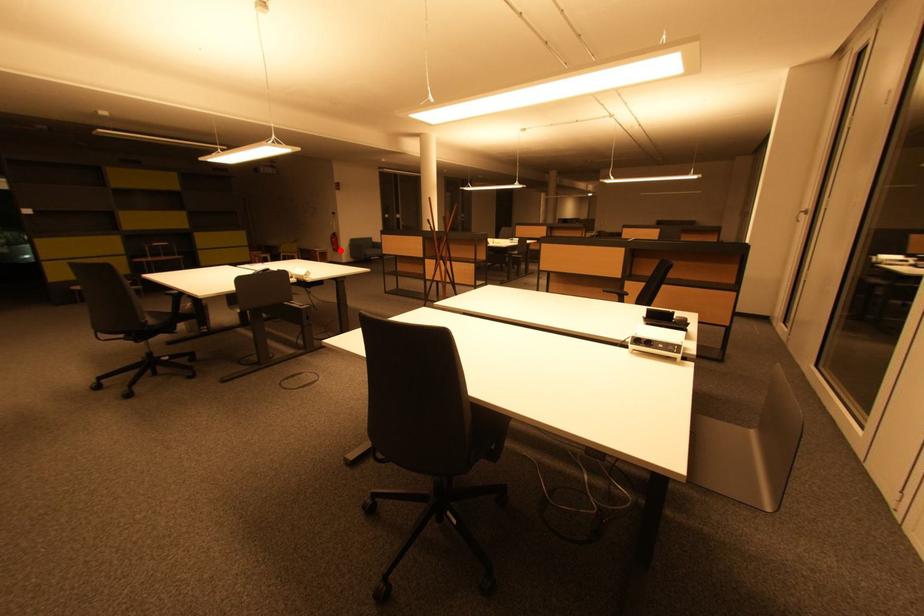
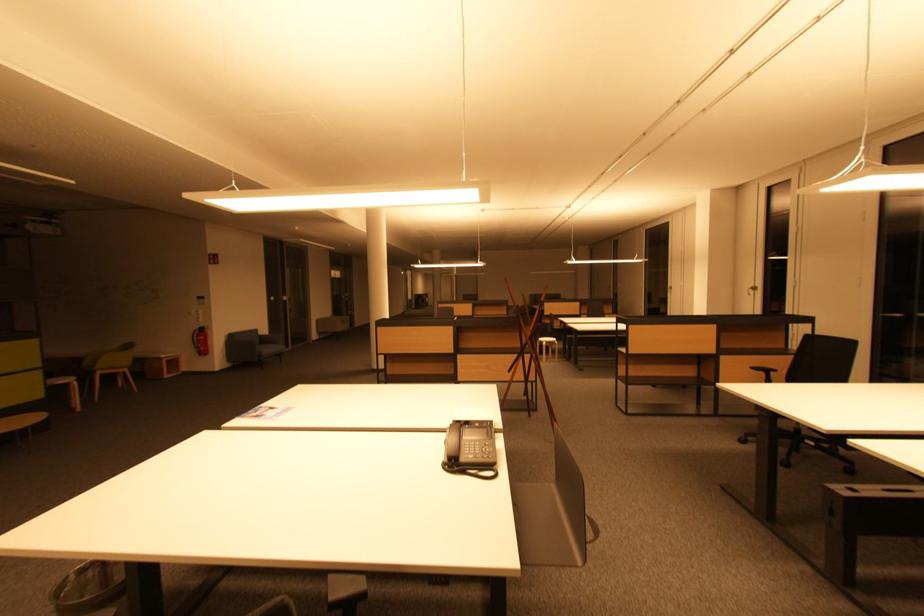
Question: A red point is marked in image1. In image2, is the corresponding 3D point closer to the camera or farther? Reply with the corresponding letter.

Choices:
 (A) The corresponding 3D point is closer.
 (B) The corresponding 3D point is farther.

Answer: (B)